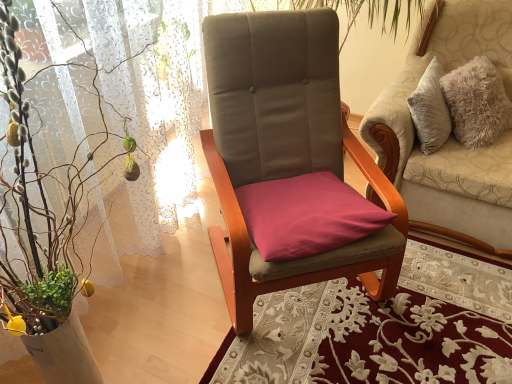
Question: Is the depth of purple fabric cushion at center greater than that of green leafy plant at left?

Choices:
 (A) no
 (B) yes

Answer: (B)

Question: Is purple fabric cushion at center aimed at green leafy plant at left?

Choices:
 (A) yes
 (B) no

Answer: (B)

Question: Is purple fabric cushion at center surrounding green leafy plant at left?

Choices:
 (A) no
 (B) yes

Answer: (A)

Question: Can you see purple fabric cushion at center touching green leafy plant at left?

Choices:
 (A) yes
 (B) no

Answer: (B)

Question: From a real-world perspective, is purple fabric cushion at center beneath green leafy plant at left?

Choices:
 (A) yes
 (B) no

Answer: (A)

Question: In the image, is suede-like beige chair at center, marked as the second chair in a right-to-left arrangement, positioned in front of or behind purple fabric cushion at center?

Choices:
 (A) behind
 (B) front

Answer: (B)

Question: Is suede-like beige chair at center, marked as the second chair in a right-to-left arrangement, situated inside purple fabric cushion at center or outside?

Choices:
 (A) inside
 (B) outside

Answer: (B)

Question: From a real-world perspective, is suede-like beige chair at center, the 1th chair when ordered from left to right, above or below purple fabric cushion at center?

Choices:
 (A) above
 (B) below

Answer: (A)

Question: Based on their sizes in the image, would you say suede-like beige chair at center, marked as the second chair in a right-to-left arrangement, is bigger or smaller than purple fabric cushion at center?

Choices:
 (A) big
 (B) small

Answer: (A)

Question: Considering the relative positions of purple fabric cushion at center and green leafy plant at left in the image provided, is purple fabric cushion at center to the left or to the right of green leafy plant at left?

Choices:
 (A) right
 (B) left

Answer: (A)

Question: From the image's perspective, is purple fabric cushion at center located above or below green leafy plant at left?

Choices:
 (A) below
 (B) above

Answer: (B)

Question: In the image, is purple fabric cushion at center positioned in front of or behind green leafy plant at left?

Choices:
 (A) front
 (B) behind

Answer: (B)

Question: In terms of size, does purple fabric cushion at center appear bigger or smaller than green leafy plant at left?

Choices:
 (A) small
 (B) big

Answer: (A)

Question: Is green leafy plant at left situated inside purple fabric cushion at center or outside?

Choices:
 (A) inside
 (B) outside

Answer: (B)

Question: Is point (9, 125) closer or farther from the camera than point (360, 236)?

Choices:
 (A) farther
 (B) closer

Answer: (B)